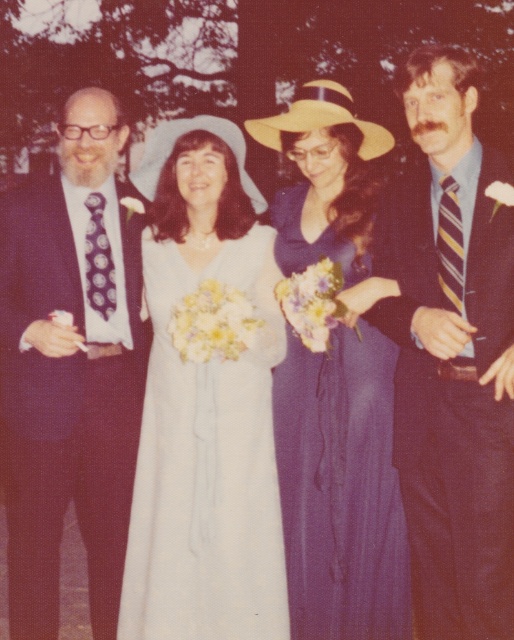
Question: Which point is closer to the camera taking this photo?

Choices:
 (A) (216, 481)
 (B) (415, 483)

Answer: (B)

Question: Which is nearer to the striped tie at right?

Choices:
 (A) matte black suit at left
 (B) purple satin dress at center
 (C) white satin dress at center

Answer: (B)

Question: Which object is the closest to the purple satin dress at center?

Choices:
 (A) matte black suit at left
 (B) striped tie at right

Answer: (B)

Question: Can you confirm if matte black suit at left is smaller than white satin dress at center?

Choices:
 (A) yes
 (B) no

Answer: (B)

Question: Does striped tie at right have a larger size compared to white satin dress at center?

Choices:
 (A) yes
 (B) no

Answer: (A)

Question: Is matte black suit at left thinner than white satin dress at center?

Choices:
 (A) yes
 (B) no

Answer: (A)